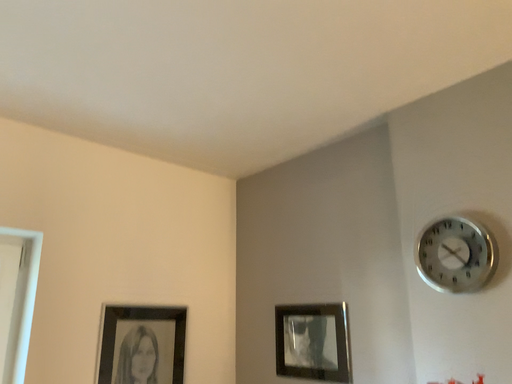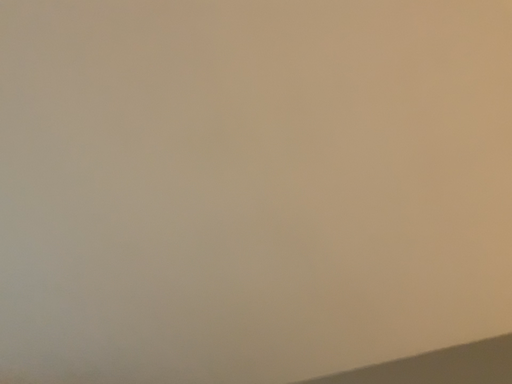
Question: How did the camera likely rotate when shooting the video?

Choices:
 (A) rotated upward
 (B) rotated downward

Answer: (A)